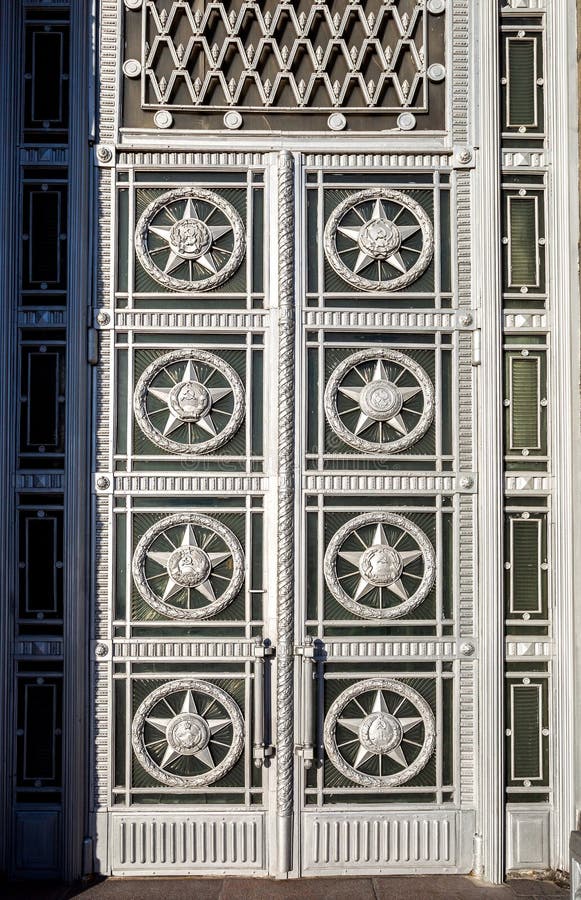
At what (x,y) coordinates should I click in order to perform the action: click on left pillar. Please return your answer as a coordinate pair (x, y). Image resolution: width=581 pixels, height=900 pixels. Looking at the image, I should click on (71, 734).